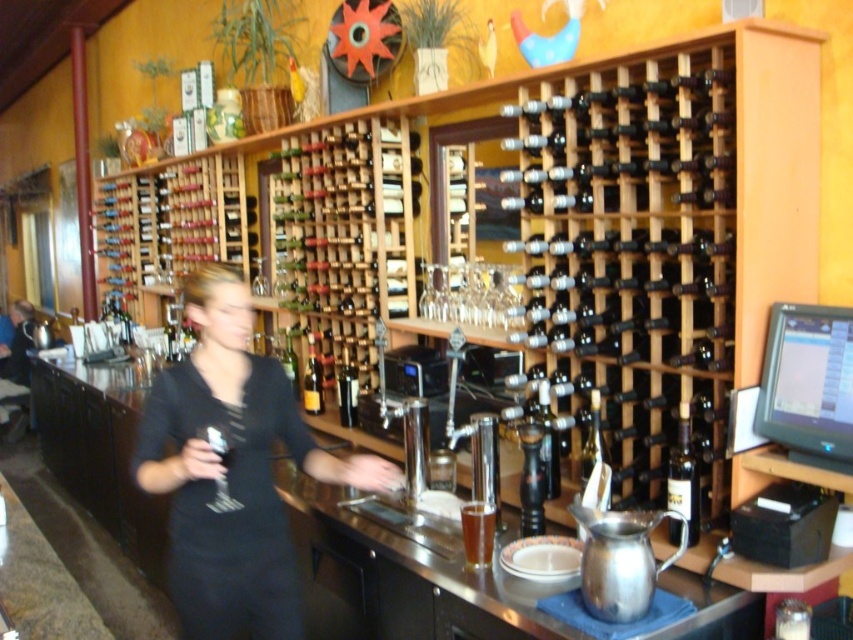
Does clear glass wine glass at center lie behind shiny dark glass bottle at center?

No, clear glass wine glass at center is closer to the viewer.

Is clear glass wine glass at center closer to camera compared to shiny dark glass bottle at center?

That is True.

Identify the location of clear glass wine glass at center. This screenshot has height=640, width=853. (218, 442).

Find the location of a particular element. This screenshot has height=640, width=853. clear glass wine glass at center is located at coordinates click(218, 442).

Does point (679, 413) come closer to viewer compared to point (320, 406)?

That is True.

Is dark brown glass bottle at center-right positioned at the back of shiny gold bottle at center?

That is False.

Where is `dark brown glass bottle at center-right`? Image resolution: width=853 pixels, height=640 pixels. dark brown glass bottle at center-right is located at coordinates (683, 476).

Locate an element on the screen. dark brown glass bottle at center-right is located at coordinates (683, 476).

Can you confirm if black fabric dress at center is shorter than matte black shirt at left?

Yes.

Which is more to the left, black fabric dress at center or matte black shirt at left?

From the viewer's perspective, matte black shirt at left appears more on the left side.

Identify the location of black fabric dress at center. (233, 470).